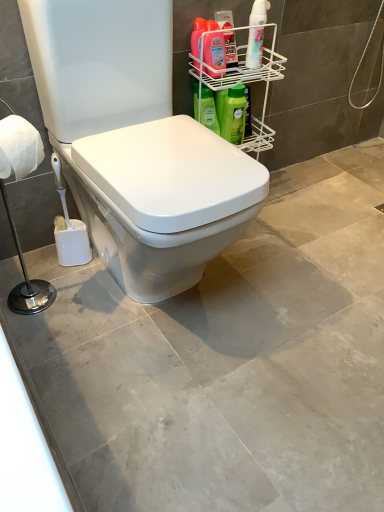
Question: Are green matte bottle at upper right, positioned as the 4th cleaning product in left-to-right order, and green matte bottle at upper right, the 5th cleaning product when ordered from right to left, beside each other?

Choices:
 (A) yes
 (B) no

Answer: (A)

Question: From the image's perspective, is green matte bottle at upper right, the second cleaning product in the right-to-left sequence, above green matte bottle at upper right, the 5th cleaning product when ordered from right to left?

Choices:
 (A) no
 (B) yes

Answer: (B)

Question: Is green matte bottle at upper right, the second cleaning product in the right-to-left sequence, located outside green matte bottle at upper right, the first cleaning product positioned from the left?

Choices:
 (A) yes
 (B) no

Answer: (A)

Question: Considering the relative positions of green matte bottle at upper right, positioned as the 4th cleaning product in left-to-right order, and green matte bottle at upper right, the 5th cleaning product when ordered from right to left, in the image provided, is green matte bottle at upper right, positioned as the 4th cleaning product in left-to-right order, to the right of green matte bottle at upper right, the 5th cleaning product when ordered from right to left, from the viewer's perspective?

Choices:
 (A) yes
 (B) no

Answer: (A)

Question: From the image's perspective, is green matte bottle at upper right, positioned as the 4th cleaning product in left-to-right order, under green matte bottle at upper right, the first cleaning product positioned from the left?

Choices:
 (A) yes
 (B) no

Answer: (B)

Question: Considering the relative sizes of green matte bottle at upper right, the second cleaning product in the right-to-left sequence, and green matte bottle at upper right, the 5th cleaning product when ordered from right to left, in the image provided, is green matte bottle at upper right, the second cleaning product in the right-to-left sequence, taller than green matte bottle at upper right, the 5th cleaning product when ordered from right to left,?

Choices:
 (A) no
 (B) yes

Answer: (B)

Question: Could you tell me if white matte toilet paper at left is turned towards matte pink bottle at upper right, the 4th cleaning product from the right?

Choices:
 (A) yes
 (B) no

Answer: (B)

Question: From the image's perspective, is white matte toilet paper at left under matte pink bottle at upper right, positioned as the 2th cleaning product in left-to-right order?

Choices:
 (A) no
 (B) yes

Answer: (B)

Question: Considering the relative positions of white matte toilet paper at left and matte pink bottle at upper right, positioned as the 2th cleaning product in left-to-right order, in the image provided, is white matte toilet paper at left to the left of matte pink bottle at upper right, positioned as the 2th cleaning product in left-to-right order, from the viewer's perspective?

Choices:
 (A) no
 (B) yes

Answer: (B)

Question: Considering the relative sizes of white matte toilet paper at left and matte pink bottle at upper right, positioned as the 2th cleaning product in left-to-right order, in the image provided, is white matte toilet paper at left bigger than matte pink bottle at upper right, positioned as the 2th cleaning product in left-to-right order,?

Choices:
 (A) no
 (B) yes

Answer: (B)

Question: Is white matte toilet paper at left positioned beyond the bounds of matte pink bottle at upper right, positioned as the 2th cleaning product in left-to-right order?

Choices:
 (A) no
 (B) yes

Answer: (B)

Question: Does white matte toilet paper at left contain matte pink bottle at upper right, the 4th cleaning product from the right?

Choices:
 (A) yes
 (B) no

Answer: (B)

Question: Is white glossy spray bottle at upper right, acting as the fifth cleaning product starting from the left, oriented away from matte pink bottle at upper right, positioned as the 2th cleaning product in left-to-right order?

Choices:
 (A) no
 (B) yes

Answer: (A)